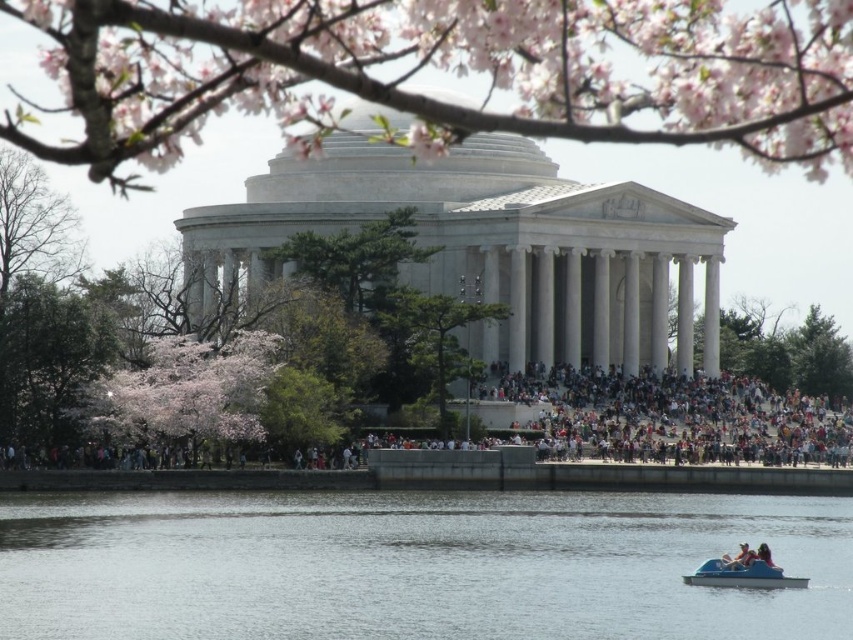
What do you see at coordinates (741, 573) in the screenshot? The width and height of the screenshot is (853, 640). I see `blue plastic boat at lower right` at bounding box center [741, 573].

Which is more to the left, blue plastic boat at lower right or light blue fabric boat at lower right?

blue plastic boat at lower right

Consider the image. Measure the distance between blue plastic boat at lower right and camera.

They are 276.52 feet apart.

This screenshot has width=853, height=640. In order to click on blue plastic boat at lower right in this screenshot , I will do `click(741, 573)`.

Is pink blossoms at center to the right of light blue fabric boat at lower right from the viewer's perspective?

Incorrect, pink blossoms at center is not on the right side of light blue fabric boat at lower right.

Is pink blossoms at center smaller than light blue fabric boat at lower right?

No, pink blossoms at center is not smaller than light blue fabric boat at lower right.

Is point (155, 148) behind point (733, 557)?

That is False.

Find the location of a particular element. pink blossoms at center is located at coordinates (445, 70).

Is point (733, 410) behind point (45, 356)?

That is True.

Can you confirm if multicolored fabric crowd at center is smaller than pink blossoms at lower left?

Actually, multicolored fabric crowd at center might be larger than pink blossoms at lower left.

Does point (672, 413) come in front of point (79, 305)?

No, it is not.

This screenshot has height=640, width=853. What are the coordinates of `multicolored fabric crowd at center` in the screenshot? It's located at (679, 417).